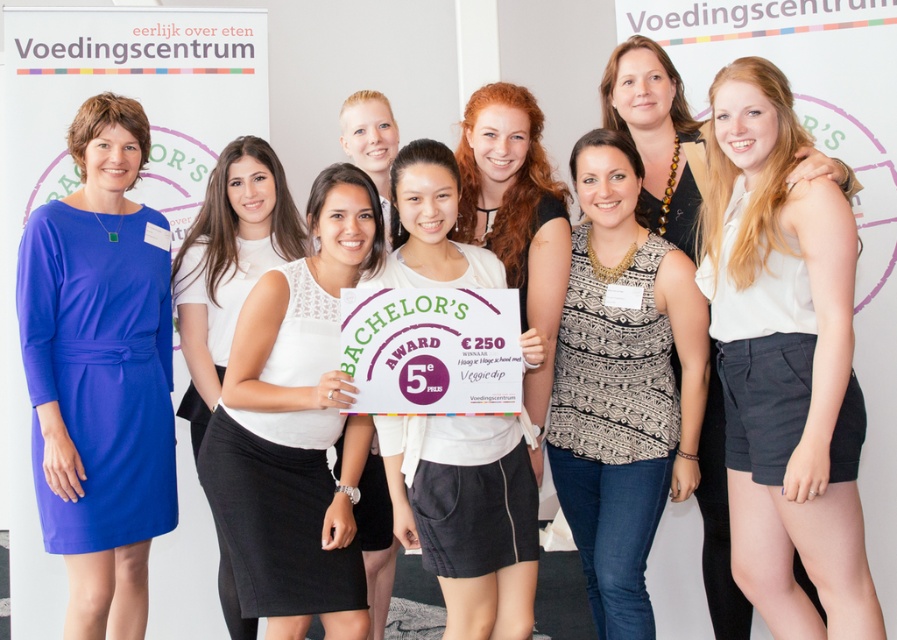
Is black printed tank top at center smaller than blonde hair at center?

Yes, black printed tank top at center is smaller than blonde hair at center.

Between black printed tank top at center and blonde hair at center, which one has less height?

blonde hair at center

Which is behind, point (693, 390) or point (471, 236)?

The point (471, 236) is behind.

Identify the location of black printed tank top at center. Image resolution: width=897 pixels, height=640 pixels. (623, 385).

Between point (251, 481) and point (479, 451), which one is positioned behind?

The point (251, 481) is more distant.

Does white lace top at center have a smaller size compared to white matte shirt at center?

No, white lace top at center is not smaller than white matte shirt at center.

Who is more forward, [329,212] or [529,632]?

Positioned in front is point [529,632].

This screenshot has width=897, height=640. What are the coordinates of `white lace top at center` in the screenshot? It's located at (295, 428).

Identify the location of matte blue dress at left. (100, 371).

Who is more forward, (x=120, y=499) or (x=486, y=636)?

Positioned in front is point (x=486, y=636).

This screenshot has height=640, width=897. I want to click on matte blue dress at left, so click(100, 371).